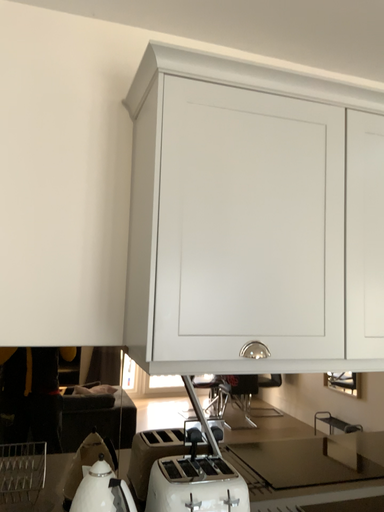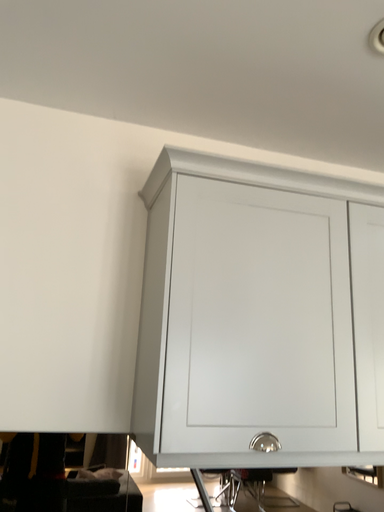
Question: How did the camera likely rotate when shooting the video?

Choices:
 (A) rotated downward
 (B) rotated upward

Answer: (B)